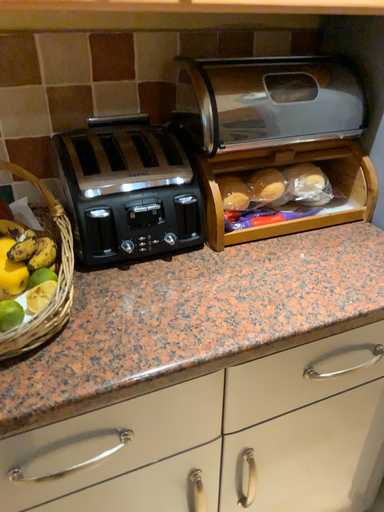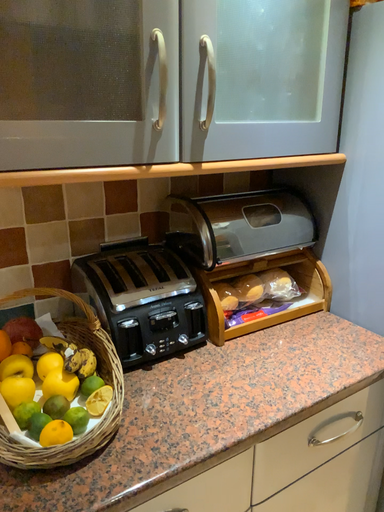
Question: Which way did the camera rotate in the video?

Choices:
 (A) rotated right
 (B) rotated left

Answer: (A)